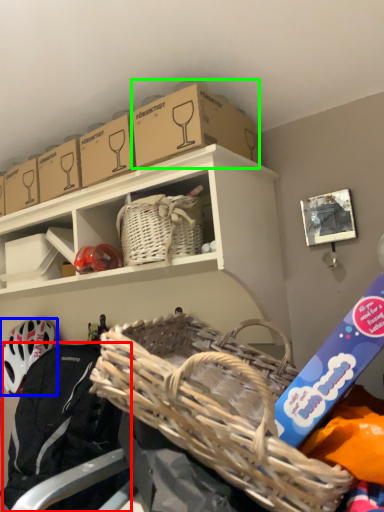
Question: Considering the real-world distances, which object is farthest from clothing (highlighted by a red box)? helmet (highlighted by a blue box) or storage box (highlighted by a green box)?

Choices:
 (A) helmet
 (B) storage box

Answer: (B)